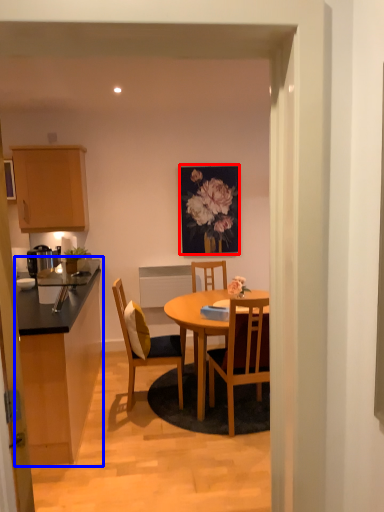
Question: Which point is closer to the camera, picture frame (highlighted by a red box) or cabinetry (highlighted by a blue box)?

Choices:
 (A) picture frame
 (B) cabinetry

Answer: (B)